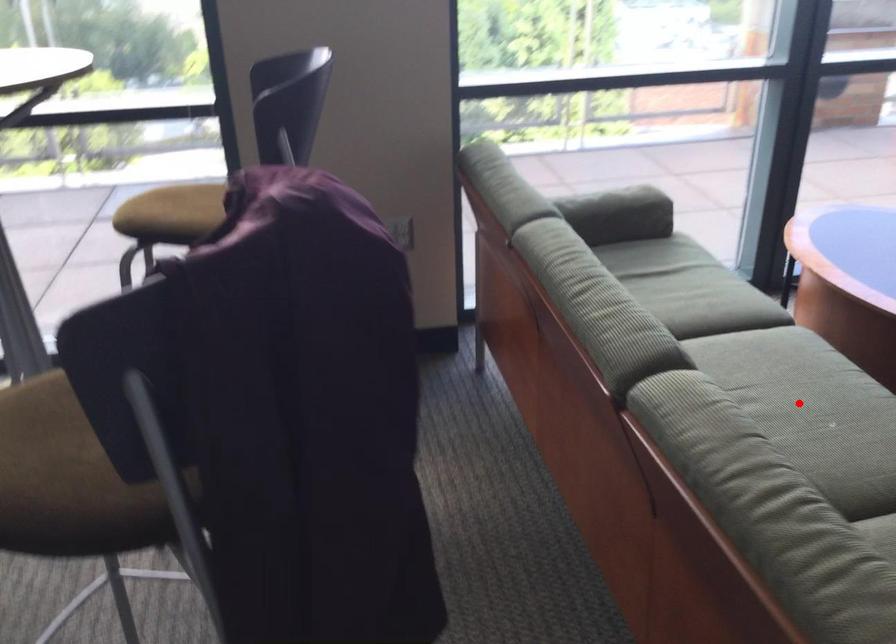
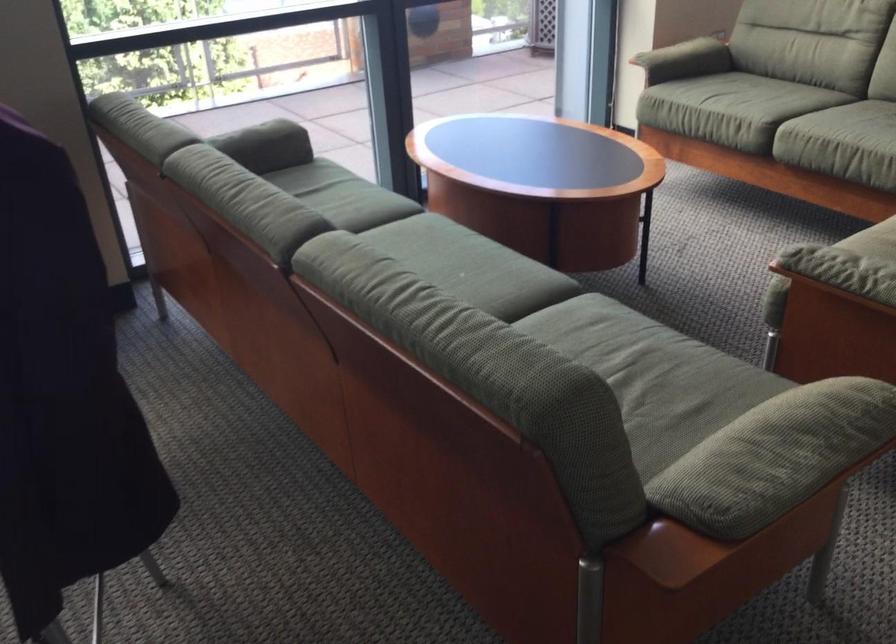
Question: I am providing you with two images of the same scene from different viewpoints. In image1, a red point is highlighted. Considering the same 3D point in image2, which of the following is correct?

Choices:
 (A) It is closer
 (B) It is farther

Answer: (B)